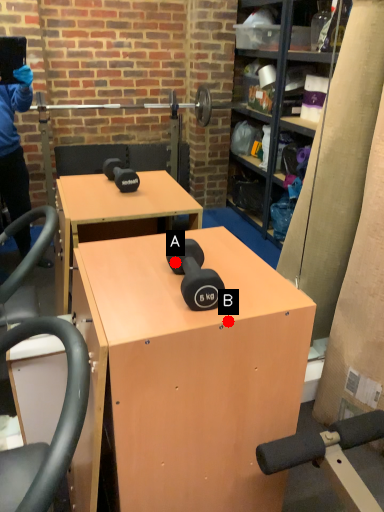
Question: Two points are circled on the image, labeled by A and B beside each circle. Which of the following is the closest to the observer?

Choices:
 (A) A is closer
 (B) B is closer

Answer: (B)